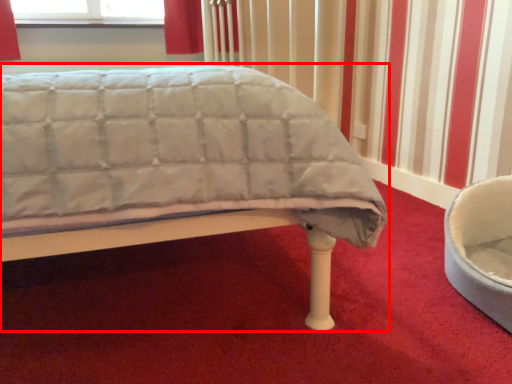
Question: From the image's perspective, where is bed (annotated by the red box) located relative to bean bag chair?

Choices:
 (A) below
 (B) above

Answer: (B)